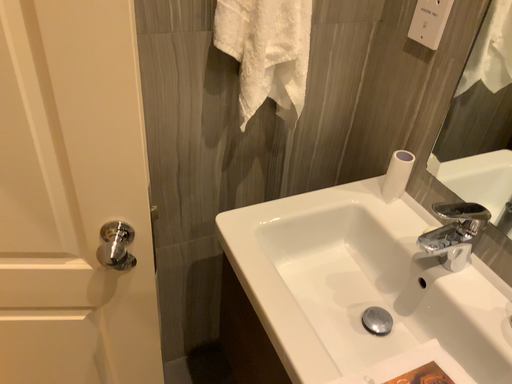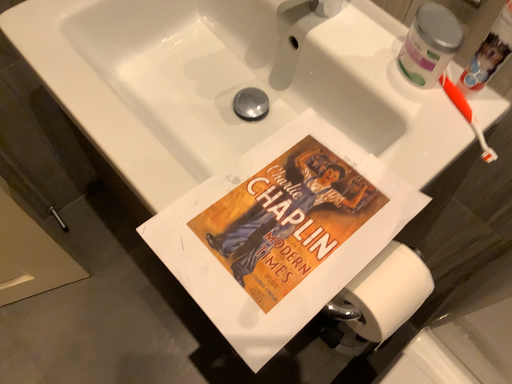
Question: How did the camera likely rotate when shooting the video?

Choices:
 (A) rotated upward
 (B) rotated downward

Answer: (B)